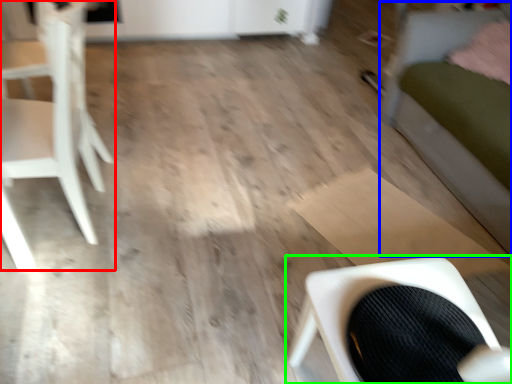
Question: Which object is positioned closest to chair (highlighted by a red box)? Select from bed (highlighted by a blue box) and chair (highlighted by a green box).

Choices:
 (A) bed
 (B) chair

Answer: (B)